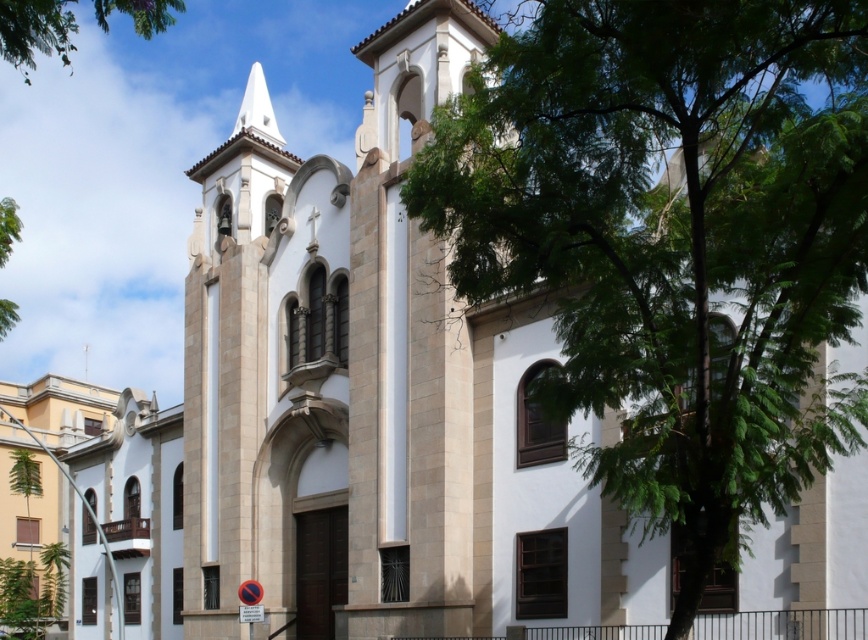
Question: Does white smooth spire at upper center have a lesser width compared to green leafy tree at left?

Choices:
 (A) yes
 (B) no

Answer: (B)

Question: Which of the following is the closest to the observer?

Choices:
 (A) white smooth spire at upper center
 (B) green leafy tree at left
 (C) green leafy tree at upper left
 (D) green leafy tree at center

Answer: (D)

Question: Which of the following is the closest to the observer?

Choices:
 (A) green leafy tree at upper left
 (B) green leafy tree at left
 (C) green leafy tree at center
 (D) white smooth spire at upper center

Answer: (C)

Question: Estimate the real-world distances between objects in this image. Which object is farther from the green leafy tree at center?

Choices:
 (A) white smooth spire at upper center
 (B) green leafy tree at upper left
 (C) green leafy tree at left

Answer: (A)

Question: Does white smooth spire at upper center have a larger size compared to green leafy tree at left?

Choices:
 (A) yes
 (B) no

Answer: (A)

Question: Does green leafy tree at center appear on the left side of green leafy tree at upper left?

Choices:
 (A) no
 (B) yes

Answer: (A)